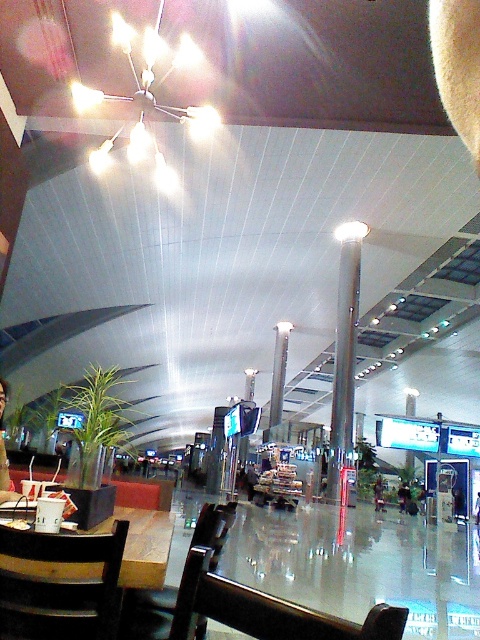
Who is shorter, wooden chair at lower left or polished silver pole at center?

With less height is polished silver pole at center.

Where is `wooden chair at lower left`? Image resolution: width=480 pixels, height=640 pixels. wooden chair at lower left is located at coordinates (60, 586).

You are a GUI agent. You are given a task and a screenshot of the screen. Output one action in this format:
    pyautogui.click(x=<x>, y=<y>)
    Task: Click on the wooden chair at lower left
    Image resolution: width=480 pixels, height=640 pixels.
    Given the screenshot: What is the action you would take?
    click(x=60, y=586)

Is wooden chair at lower left thinner than white glossy chandelier at upper center?

Correct, wooden chair at lower left's width is less than white glossy chandelier at upper center's.

Can you confirm if wooden chair at lower left is taller than white glossy chandelier at upper center?

Yes.

Is point (14, 545) closer to camera compared to point (147, 90)?

Yes, it is.

In order to click on wooden chair at lower left in this screenshot , I will do `click(60, 586)`.

The height and width of the screenshot is (640, 480). In order to click on wooden chair at lower center in this screenshot , I will do `click(278, 612)`.

Measure the distance between point (376, 620) and camera.

22.97 inches

Locate an element on the screen. wooden chair at lower center is located at coordinates (278, 612).